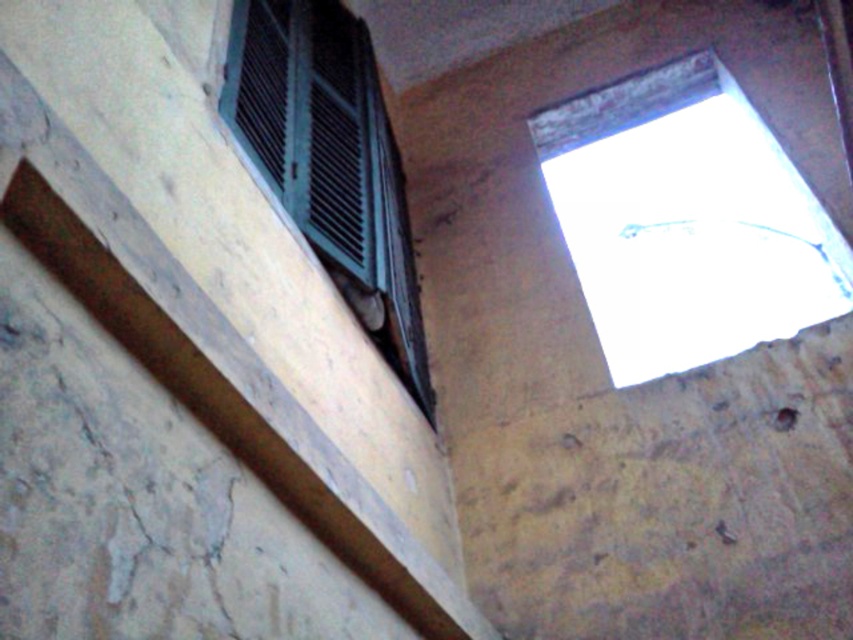
You are a painter standing 2 meters away from the brown wood beam at upper left and the window with shutters. You have a ladder that is 1.2 meters long. Can you reach both objects with your ladder without moving it?

The distance between the brown wood beam at upper left and the window with shutters is 1.14 meters. Since the ladder is 1.2 meters long, you can position it to reach both objects as the distance between them is within the ladder length.

You are a painter standing at the base of the building. You need to paint the brown wood beam at upper left located at point (225, 387). What direction should you move to reach it from your current position?

The brown wood beam at upper left is located at point (225, 387), so you should move upward and to the left to reach it from the base of the building.